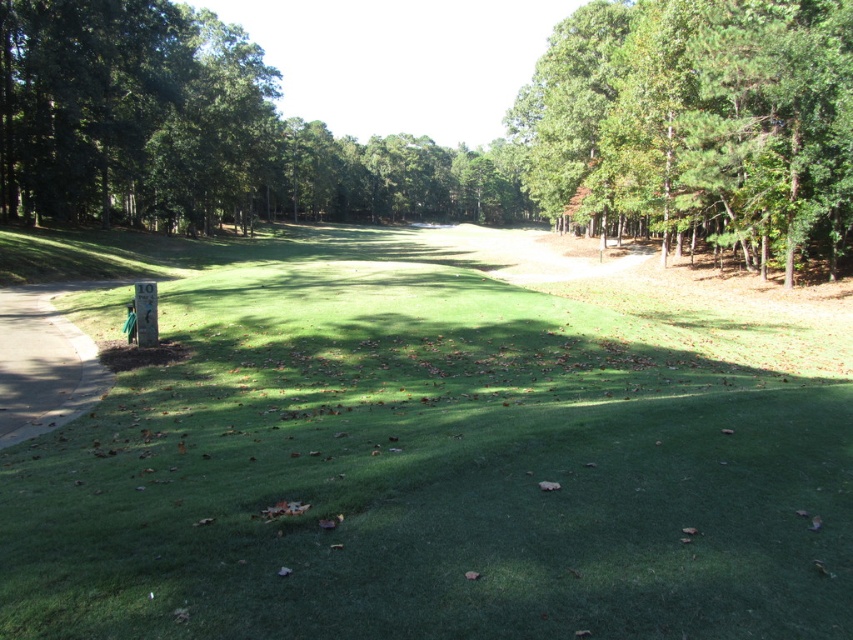
Is point (788, 44) more distant than point (102, 394)?

Yes, it is behind point (102, 394).

Is green leafy trees at upper right smaller than concrete at left?

No, green leafy trees at upper right is not smaller than concrete at left.

Who is more forward, (726, 188) or (15, 324)?

Point (15, 324) is in front.

In order to click on green leafy trees at upper right in this screenshot , I will do [x=699, y=122].

Can you confirm if green turf at center is positioned below concrete at left?

Incorrect, green turf at center is not positioned below concrete at left.

Based on the photo, is green turf at center to the right of concrete at left from the viewer's perspective?

Correct, you'll find green turf at center to the right of concrete at left.

Does point (428, 257) come closer to viewer compared to point (115, 282)?

No, (428, 257) is behind (115, 282).

Identify the location of green turf at center. The image size is (853, 640). (434, 465).

Who is positioned more to the right, green turf at center or green leafy trees at upper right?

green leafy trees at upper right

Is green turf at center above green leafy trees at upper right?

No, green turf at center is not above green leafy trees at upper right.

The image size is (853, 640). What do you see at coordinates (434, 465) in the screenshot?
I see `green turf at center` at bounding box center [434, 465].

Where is `green turf at center`? green turf at center is located at coordinates (434, 465).